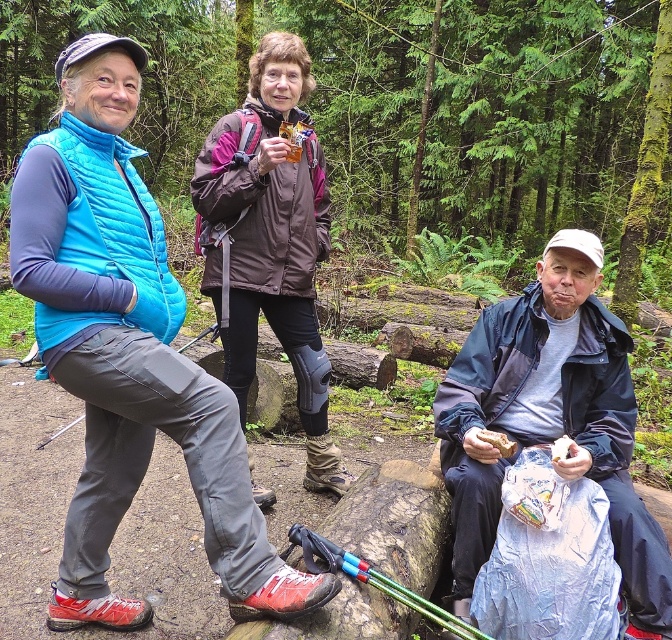
You are a hiker who wants to place your dark blue jacket at lower right next to your matte brown sandwich at lower center. Can you do that without moving the sandwich?

The dark blue jacket at lower right is 11.19 inches away from the matte brown sandwich at lower center. Since the distance is sufficient, you can move the jacket closer to the sandwich without needing to move the sandwich itself.